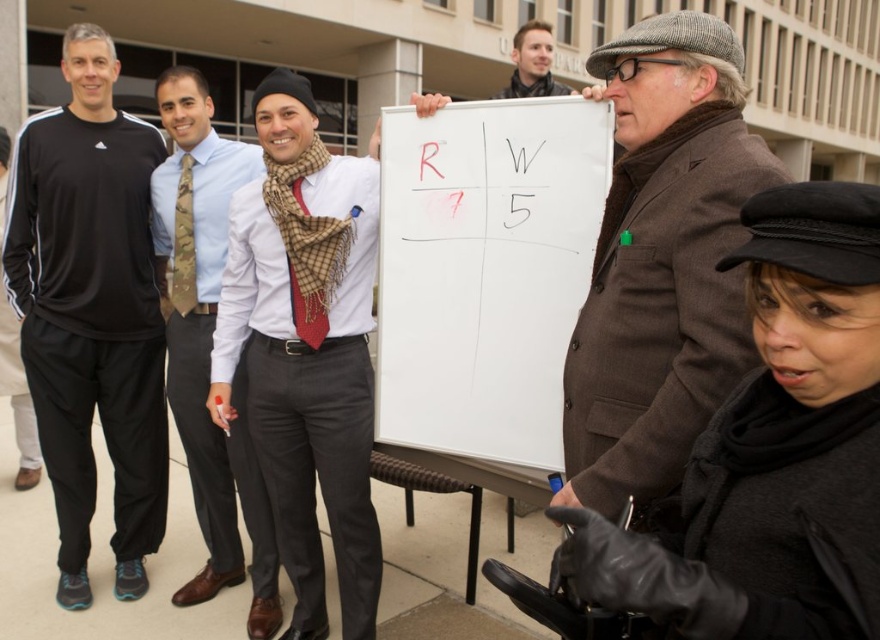
Does brown wool coat at center appear under plaid scarf at center?

No.

What do you see at coordinates (662, 262) in the screenshot? Image resolution: width=880 pixels, height=640 pixels. I see `brown wool coat at center` at bounding box center [662, 262].

Where is `brown wool coat at center`? The width and height of the screenshot is (880, 640). brown wool coat at center is located at coordinates (662, 262).

Who is higher up, black leather gloves at lower right or white matte board at center?

white matte board at center

Who is taller, black leather gloves at lower right or white matte board at center?

With more height is white matte board at center.

Which is in front, point (708, 490) or point (440, 173)?

Point (708, 490) is more forward.

At what (x,y) coordinates should I click in order to perform the action: click on black leather gloves at lower right. Please return your answer as a coordinate pair (x, y). This screenshot has height=640, width=880. Looking at the image, I should click on (774, 449).

Identify the location of black leather gloves at lower right. Image resolution: width=880 pixels, height=640 pixels. (774, 449).

Is black leather gloves at lower right smaller than brown wool coat at center?

Indeed, black leather gloves at lower right has a smaller size compared to brown wool coat at center.

Which is in front, point (823, 205) or point (644, 35)?

Point (823, 205) is more forward.

Where is `black leather gloves at lower right`? This screenshot has height=640, width=880. black leather gloves at lower right is located at coordinates (774, 449).